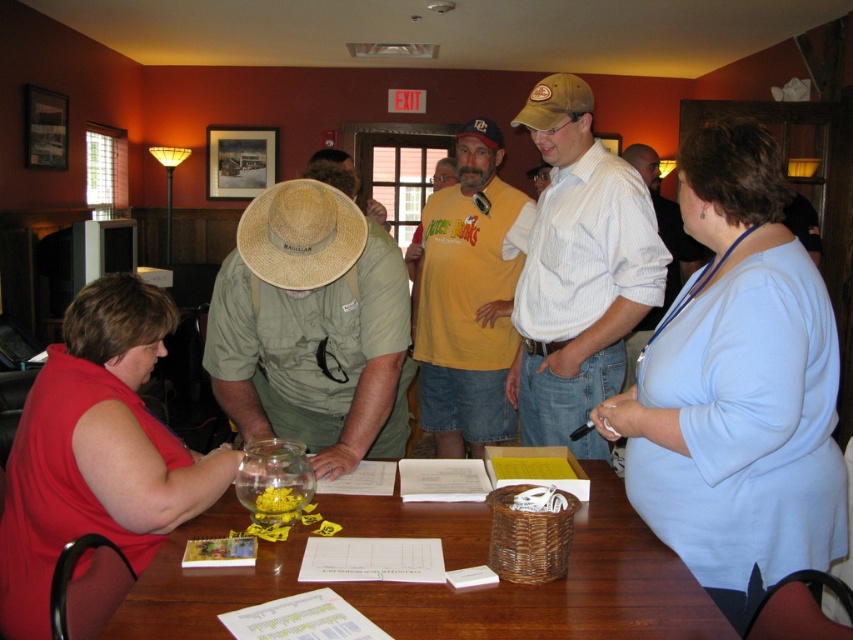
Which is more to the left, green canvas hat at center or strawhat at center?

From the viewer's perspective, green canvas hat at center appears more on the left side.

Is point (316, 381) farther from viewer compared to point (350, 200)?

Yes, it is behind point (350, 200).

Locate an element on the screen. This screenshot has width=853, height=640. green canvas hat at center is located at coordinates (312, 326).

Is point (540, 336) in front of point (526, 112)?

That is False.

How distant is white striped shirt at center from brown canvas cowboy hat at upper center?

white striped shirt at center and brown canvas cowboy hat at upper center are 48.18 centimeters apart from each other.

Locate an element on the screen. Image resolution: width=853 pixels, height=640 pixels. white striped shirt at center is located at coordinates (578, 272).

You are a GUI agent. You are given a task and a screenshot of the screen. Output one action in this format:
    pyautogui.click(x=<x>, y=<y>)
    Task: Click on the white striped shirt at center
    Image resolution: width=853 pixels, height=640 pixels.
    Given the screenshot: What is the action you would take?
    pyautogui.click(x=578, y=272)

Which is behind, point (346, 420) or point (550, 93)?

The point (550, 93) is more distant.

Identify the location of green canvas hat at center. The image size is (853, 640). (312, 326).